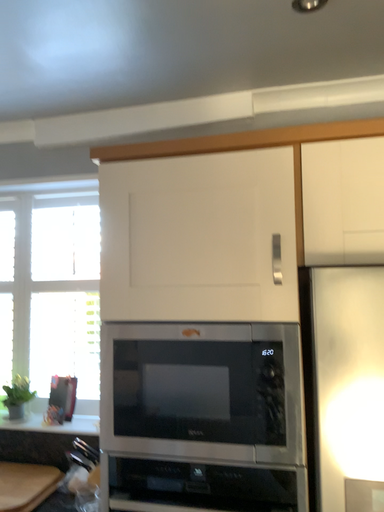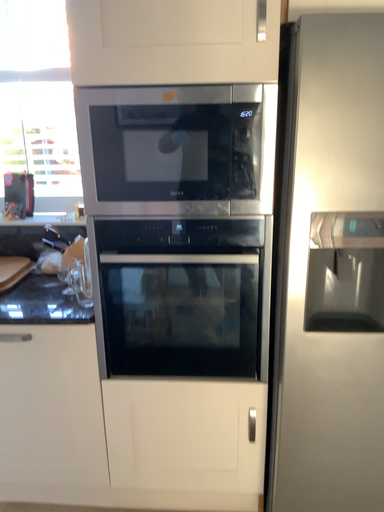
Question: How did the camera likely rotate when shooting the video?

Choices:
 (A) rotated right
 (B) rotated left

Answer: (A)